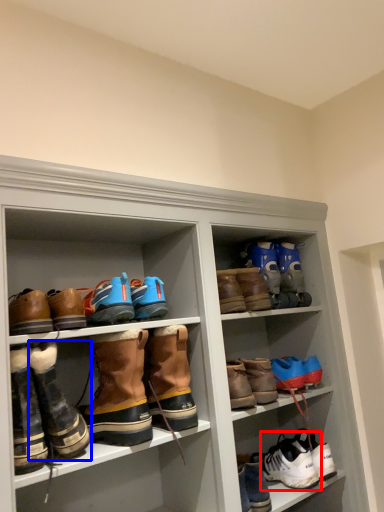
Question: Which object appears closest to the camera in this image, footwear (highlighted by a red box) or footwear (highlighted by a blue box)?

Choices:
 (A) footwear
 (B) footwear

Answer: (B)